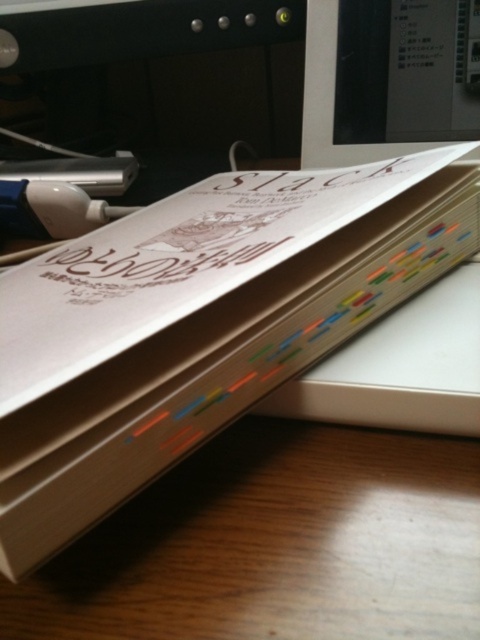
Question: In this image, where is beige paper book at center located relative to matte plastic computer monitor at upper right?

Choices:
 (A) below
 (B) above

Answer: (A)

Question: Does beige paper book at center have a lesser width compared to matte plastic computer monitor at upper right?

Choices:
 (A) yes
 (B) no

Answer: (B)

Question: Which point is farther to the camera?

Choices:
 (A) (60, 301)
 (B) (308, 10)

Answer: (B)

Question: Does beige paper book at center lie behind matte plastic computer monitor at upper right?

Choices:
 (A) no
 (B) yes

Answer: (A)